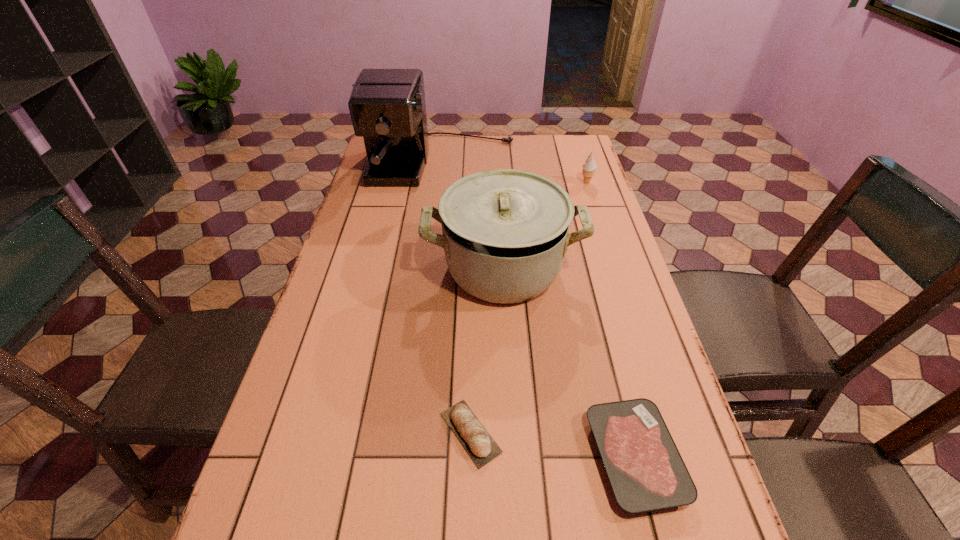
I want to click on vacant area that lies between the third farthest object and the pita bread, so click(487, 350).

Image resolution: width=960 pixels, height=540 pixels. In order to click on empty space between the pita bread and the tallest object in this screenshot , I will do `click(456, 298)`.

I want to click on free spot between the steak and the tallest object, so click(539, 310).

Identify the location of vacant area between the steak and the tallest object. (539, 310).

In order to click on vacant area that lies between the pita bread and the second tallest object in this screenshot , I will do `click(487, 350)`.

This screenshot has width=960, height=540. I want to click on unoccupied area between the coffee maker and the steak, so click(x=539, y=310).

This screenshot has height=540, width=960. In order to click on vacant area between the icecream and the fourth tallest object in this screenshot , I will do `click(529, 307)`.

Image resolution: width=960 pixels, height=540 pixels. In order to click on the closest object to the steak in this screenshot , I will do `click(481, 447)`.

Identify which object is the fourth nearest to the steak. Please provide its 2D coordinates. Your answer should be formatted as a tuple, i.e. [(x, y)], where the tuple contains the x and y coordinates of a point satisfying the conditions above.

[(589, 167)]

Where is `free space that satisfies the following two spatial constraints: 1. on the front-facing side of the fourth tallest object; 2. on the left side of the coffee maker`? This screenshot has width=960, height=540. free space that satisfies the following two spatial constraints: 1. on the front-facing side of the fourth tallest object; 2. on the left side of the coffee maker is located at coordinates (409, 433).